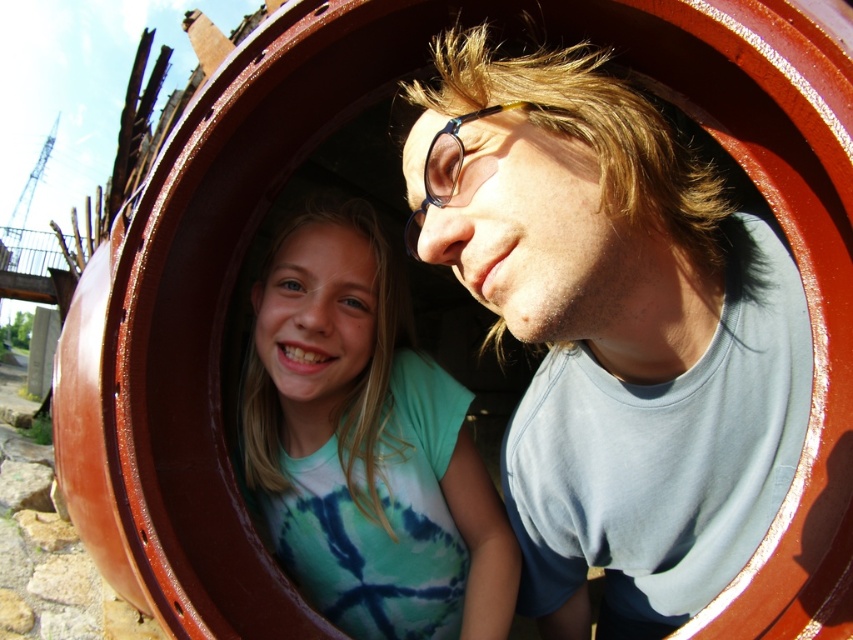
Consider the image. Can you confirm if tie-dye fabric shirt at center is thinner than blue plastic goggles at center?

In fact, tie-dye fabric shirt at center might be wider than blue plastic goggles at center.

Who is more distant from viewer, (x=369, y=476) or (x=427, y=182)?

The point (x=369, y=476) is behind.

This screenshot has height=640, width=853. Find the location of `tie-dye fabric shirt at center`. tie-dye fabric shirt at center is located at coordinates (366, 445).

Which is below, matte blue shirt at center or tie-dye fabric shirt at center?

tie-dye fabric shirt at center

Image resolution: width=853 pixels, height=640 pixels. Describe the element at coordinates (614, 333) in the screenshot. I see `matte blue shirt at center` at that location.

Which is behind, point (686, 404) or point (300, 429)?

Positioned behind is point (300, 429).

What are the coordinates of `matte blue shirt at center` in the screenshot? It's located at (614, 333).

Between point (744, 320) and point (409, 248), which one is positioned behind?

The point (409, 248) is behind.

Who is taller, matte blue shirt at center or blue plastic goggles at center?

With more height is matte blue shirt at center.

Measure the distance between matte blue shirt at center and camera.

matte blue shirt at center is 37.62 inches away from camera.

This screenshot has height=640, width=853. Identify the location of matte blue shirt at center. (614, 333).